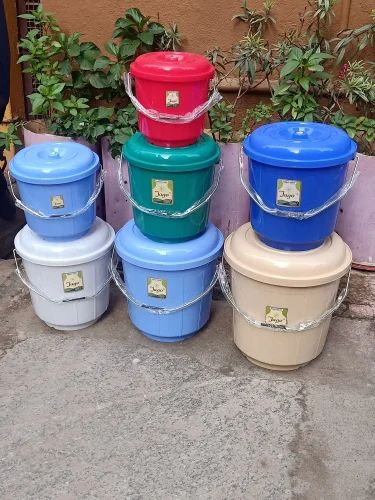
Where is `pot`? The height and width of the screenshot is (500, 375). pot is located at coordinates (28, 139).